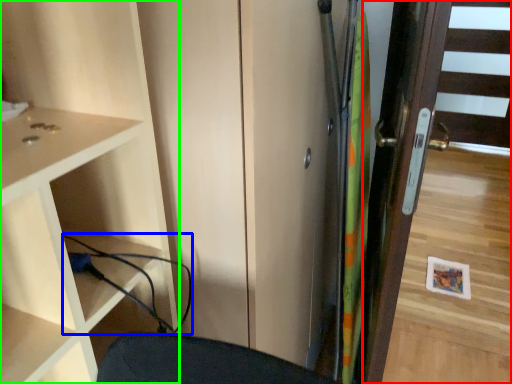
Question: Which object is the farthest from door (highlighted by a red box)? Choose among these: cable (highlighted by a blue box) or cupboard (highlighted by a green box).

Choices:
 (A) cable
 (B) cupboard

Answer: (A)